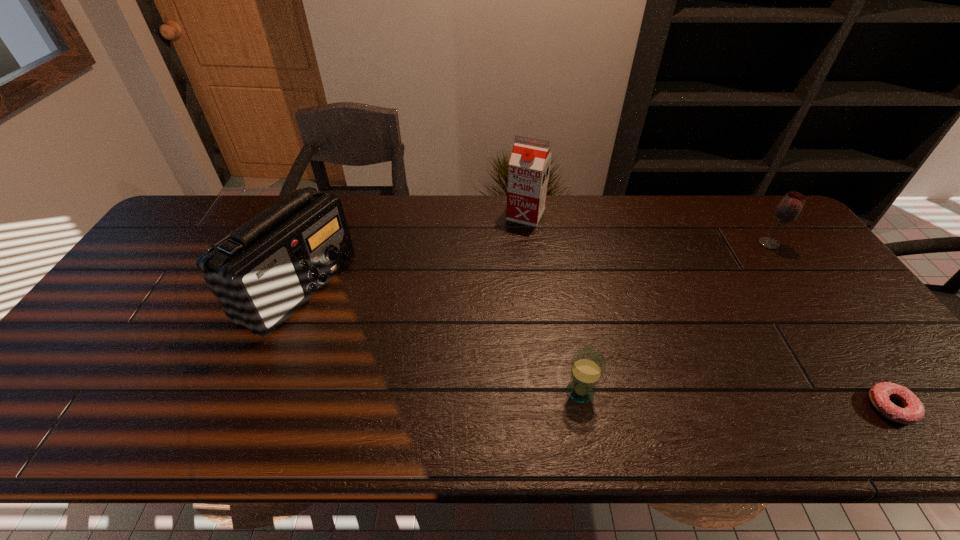
This screenshot has width=960, height=540. What are the coordinates of `free area in between the leftmost object and the soya milk` in the screenshot? It's located at (412, 252).

What are the coordinates of `free area in between the farthest object and the doughnut` in the screenshot? It's located at (708, 311).

Find the location of a particular element. The image size is (960, 540). empty space between the soya milk and the shortest object is located at coordinates (708, 311).

At what (x,y) coordinates should I click in order to perform the action: click on vacant space that's between the soya milk and the third shortest object. Please return your answer as a coordinate pair (x, y). Looking at the image, I should click on (647, 229).

I want to click on vacant space that is in between the third tallest object and the soya milk, so (647, 229).

The height and width of the screenshot is (540, 960). Find the location of `object identified as the third closest to the right glass`. object identified as the third closest to the right glass is located at coordinates (587, 365).

Locate an element on the screen. This screenshot has height=540, width=960. object that is the third closest to the leftmost object is located at coordinates (789, 208).

You are a GUI agent. You are given a task and a screenshot of the screen. Output one action in this format:
    pyautogui.click(x=<x>, y=<y>)
    Task: Click on the vacant space that satisfies the following two spatial constraints: 1. on the front panel of the radio receiver; 2. on the left side of the fourth tallest object
    Image resolution: width=960 pixels, height=540 pixels.
    Given the screenshot: What is the action you would take?
    pyautogui.click(x=256, y=392)

Identify the location of vacant point that satisfies the following two spatial constraints: 1. on the front panel of the leftmost object; 2. on the left side of the shortest object. (250, 407).

You are a GUI agent. You are given a task and a screenshot of the screen. Output one action in this format:
    pyautogui.click(x=<x>, y=<y>)
    Task: Click on the free region that satisfies the following two spatial constraints: 1. on the front panel of the radio receiver; 2. on the left side of the shorter glass
    
    Given the screenshot: What is the action you would take?
    [x=256, y=392]